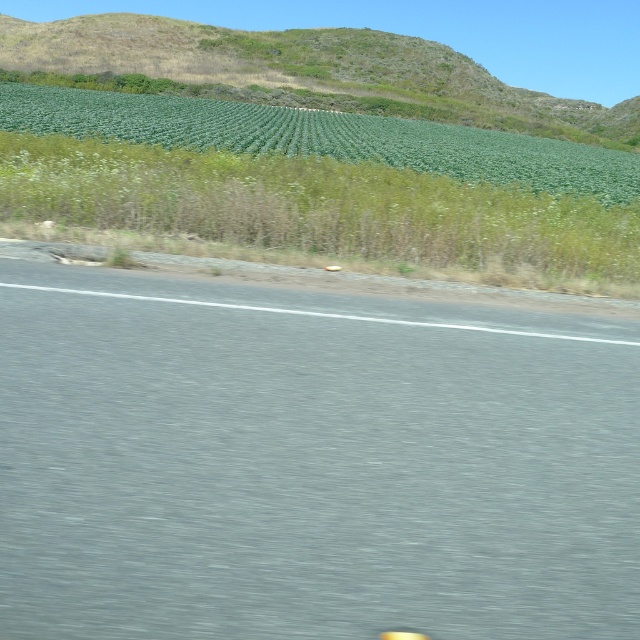
Which is more to the left, gray asphalt road at center or green leafy plants at upper center?

From the viewer's perspective, gray asphalt road at center appears more on the left side.

From the picture: Who is more forward, (164, 304) or (212, 138)?

Positioned in front is point (164, 304).

I want to click on gray asphalt road at center, so 308,464.

Can you confirm if gray asphalt road at center is bigger than green grassy hill at upper center?

Incorrect, gray asphalt road at center is not larger than green grassy hill at upper center.

The width and height of the screenshot is (640, 640). What do you see at coordinates (308, 464) in the screenshot?
I see `gray asphalt road at center` at bounding box center [308, 464].

Image resolution: width=640 pixels, height=640 pixels. I want to click on gray asphalt road at center, so click(x=308, y=464).

You are a GUI agent. You are given a task and a screenshot of the screen. Output one action in this format:
    pyautogui.click(x=<x>, y=<y>)
    Task: Click on the gray asphalt road at center
    The image size is (640, 640).
    Given the screenshot: What is the action you would take?
    pyautogui.click(x=308, y=464)

Based on the photo, which is more to the right, green grassy hill at upper center or green leafy plants at upper center?

Positioned to the right is green leafy plants at upper center.

Does point (552, 131) lie in front of point (403, 157)?

No, it is behind (403, 157).

Describe the element at coordinates (300, 72) in the screenshot. The width and height of the screenshot is (640, 640). I see `green grassy hill at upper center` at that location.

The height and width of the screenshot is (640, 640). Find the location of `green grassy hill at upper center`. green grassy hill at upper center is located at coordinates tap(300, 72).